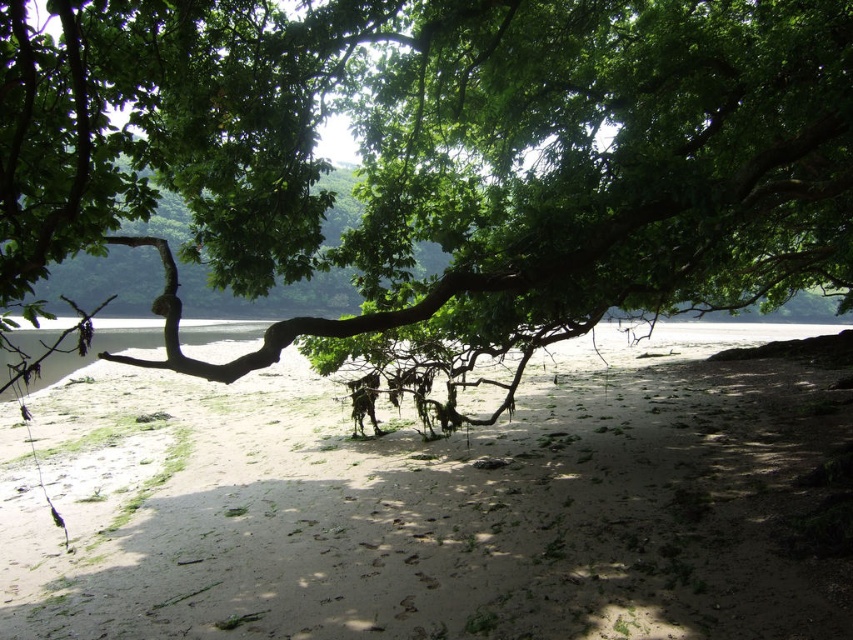
Between point (71, 243) and point (558, 518), which one is positioned behind?

Positioned behind is point (558, 518).

Is green leafy tree at center below white sandy beach at center?

Actually, green leafy tree at center is above white sandy beach at center.

Is point (3, 266) behind point (88, 611)?

No, (3, 266) is closer to viewer.

The height and width of the screenshot is (640, 853). In order to click on green leafy tree at center in this screenshot , I will do pyautogui.click(x=439, y=154).

How far apart are green leafy tree at center and clear water at center?

green leafy tree at center is 24.12 feet away from clear water at center.

Is green leafy tree at center to the left of clear water at center from the viewer's perspective?

No, green leafy tree at center is not to the left of clear water at center.

This screenshot has width=853, height=640. Identify the location of green leafy tree at center. (439, 154).

This screenshot has width=853, height=640. Identify the location of green leafy tree at center. (439, 154).

Is white sandy beach at center wider than clear water at center?

Incorrect, white sandy beach at center's width does not surpass clear water at center's.

What do you see at coordinates (408, 508) in the screenshot?
I see `white sandy beach at center` at bounding box center [408, 508].

You are a GUI agent. You are given a task and a screenshot of the screen. Output one action in this format:
    pyautogui.click(x=<x>, y=<y>)
    Task: Click on the white sandy beach at center
    
    Given the screenshot: What is the action you would take?
    pyautogui.click(x=408, y=508)